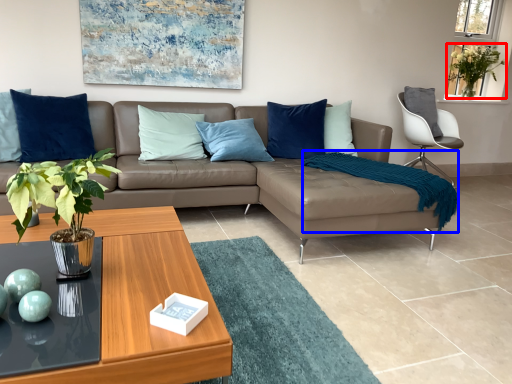
Question: Which object is closer to the camera taking this photo, plant (highlighted by a red box) or blanket (highlighted by a blue box)?

Choices:
 (A) plant
 (B) blanket

Answer: (B)